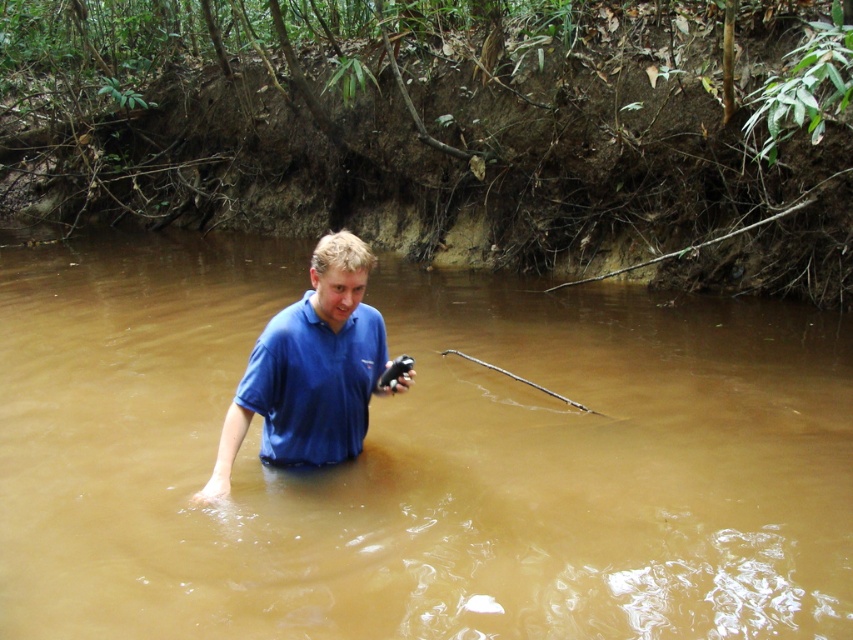
Is brown muddy water at center below blue cotton polo shirt at center?

Incorrect, brown muddy water at center is not positioned below blue cotton polo shirt at center.

Does brown muddy water at center lie in front of blue cotton polo shirt at center?

That is True.

At what (x,y) coordinates should I click in order to perform the action: click on brown muddy water at center. Please return your answer as a coordinate pair (x, y). Looking at the image, I should click on (416, 460).

Is blue matte shirt at center positioned at the back of blue cotton polo shirt at center?

No.

Does blue matte shirt at center have a lesser height compared to blue cotton polo shirt at center?

No.

Is point (299, 417) behind point (309, 401)?

Yes, point (299, 417) is farther from viewer.

You are a GUI agent. You are given a task and a screenshot of the screen. Output one action in this format:
    pyautogui.click(x=<x>, y=<y>)
    Task: Click on the blue matte shirt at center
    Image resolution: width=853 pixels, height=640 pixels.
    Given the screenshot: What is the action you would take?
    pyautogui.click(x=311, y=371)

At what (x,y) coordinates should I click in order to perform the action: click on brown muddy water at center. Please return your answer as a coordinate pair (x, y). This screenshot has height=640, width=853. Looking at the image, I should click on point(416,460).

Is point (180, 467) positioned before point (312, 380)?

No, (180, 467) is behind (312, 380).

Does point (706, 400) lie behind point (305, 410)?

Yes, point (706, 400) is farther from viewer.

At what (x,y) coordinates should I click in order to perform the action: click on brown muddy water at center. Please return your answer as a coordinate pair (x, y). This screenshot has height=640, width=853. Looking at the image, I should click on (416, 460).